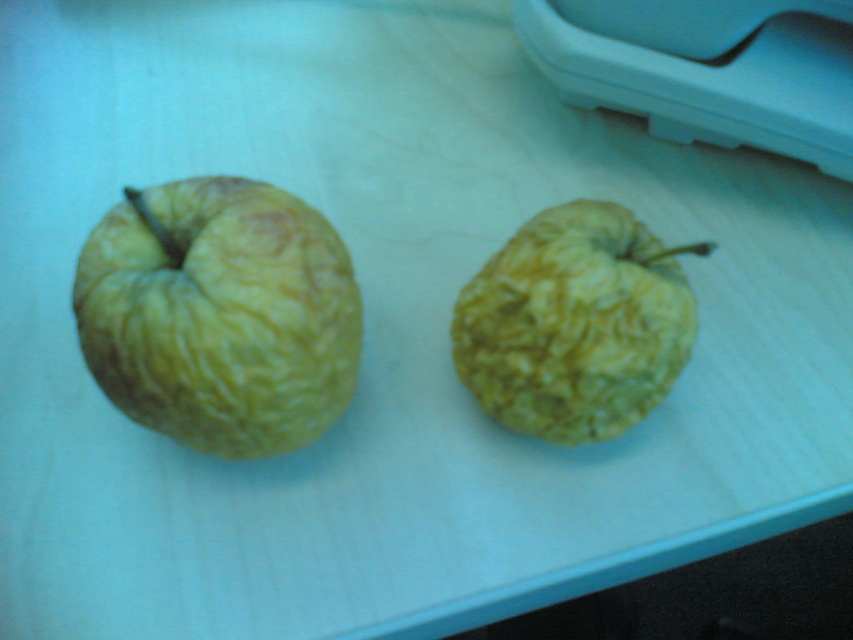
Which of these two, yellow wrinkled apple at left or blue plastic printer at upper right, stands shorter?

blue plastic printer at upper right is shorter.

Does yellow wrinkled apple at left have a lesser width compared to blue plastic printer at upper right?

Yes, yellow wrinkled apple at left is thinner than blue plastic printer at upper right.

Is point (93, 273) positioned behind point (751, 129)?

That is False.

This screenshot has height=640, width=853. I want to click on yellow wrinkled apple at left, so click(221, 316).

Who is higher up, yellow wrinkled apple at center or blue plastic printer at upper right?

blue plastic printer at upper right

Which is more to the left, yellow wrinkled apple at center or blue plastic printer at upper right?

yellow wrinkled apple at center is more to the left.

Describe the element at coordinates (575, 324) in the screenshot. I see `yellow wrinkled apple at center` at that location.

At what (x,y) coordinates should I click in order to perform the action: click on yellow wrinkled apple at center. Please return your answer as a coordinate pair (x, y). Image resolution: width=853 pixels, height=640 pixels. Looking at the image, I should click on (575, 324).

Which is more to the right, yellow wrinkled apple at left or yellow wrinkled apple at center?

Positioned to the right is yellow wrinkled apple at center.

Which is in front, point (143, 413) or point (624, 268)?

Point (143, 413) is more forward.

This screenshot has width=853, height=640. I want to click on yellow wrinkled apple at left, so click(x=221, y=316).